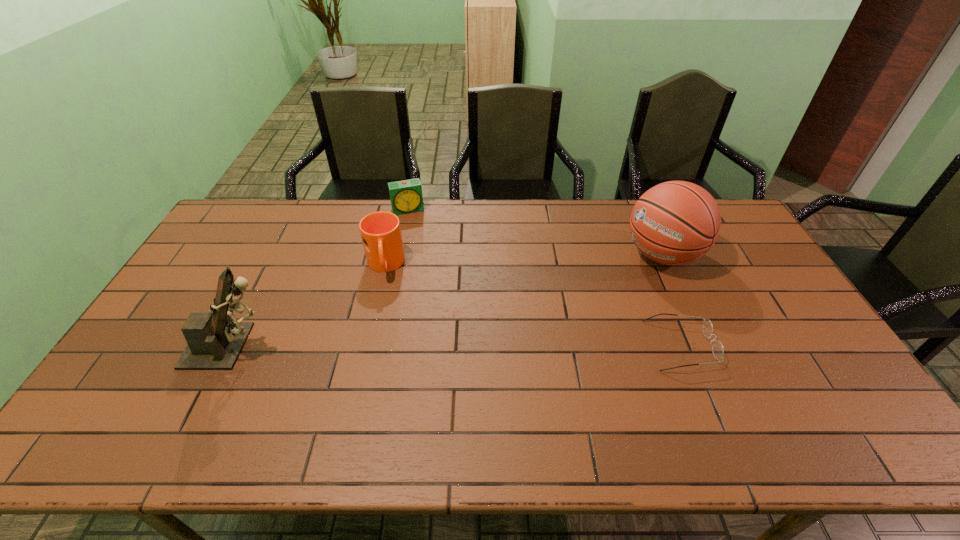
Locate an element on the screen. The width and height of the screenshot is (960, 540). the leftmost object is located at coordinates (215, 342).

The width and height of the screenshot is (960, 540). I want to click on the shortest object, so click(717, 347).

Find the location of `the third shortest object`. the third shortest object is located at coordinates (380, 231).

At what (x,y) coordinates should I click in order to perform the action: click on basketball. Please return your answer as a coordinate pair (x, y). The height and width of the screenshot is (540, 960). Looking at the image, I should click on (676, 222).

I want to click on the fourth tallest object, so click(x=406, y=197).

The height and width of the screenshot is (540, 960). I want to click on alarm clock, so click(406, 197).

At what (x,y) coordinates should I click in order to perform the action: click on vacant space located on the front-facing side of the figurine. Please return your answer as a coordinate pair (x, y). Looking at the image, I should click on (402, 346).

This screenshot has height=540, width=960. What are the coordinates of `free space located through the lenses of the spectacles` in the screenshot? It's located at (783, 345).

Locate an element on the screen. This screenshot has width=960, height=540. vacant space located on the handle side of the mug is located at coordinates 394,361.

I want to click on free space located 0.120m on the handle side of the mug, so click(388, 312).